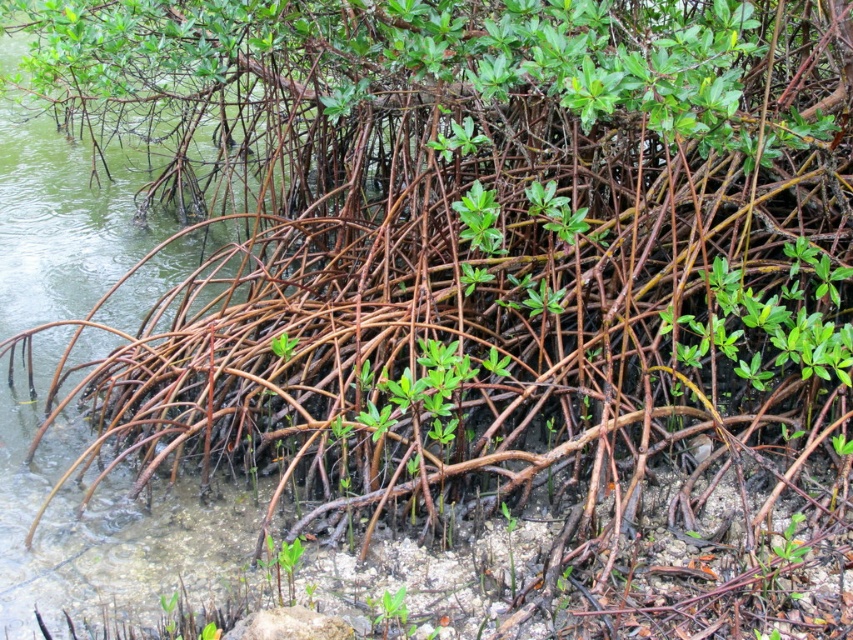
Question: Which of the following is the farthest from the observer?

Choices:
 (A) green matte leaves at center
 (B) green matte plant at center

Answer: (A)

Question: Which point appears farthest from the camera in this image?

Choices:
 (A) click(x=479, y=196)
 (B) click(x=383, y=600)

Answer: (A)

Question: Does green matte leaves at center come behind green matte plant at center?

Choices:
 (A) yes
 (B) no

Answer: (A)

Question: Does green matte leaves at center have a greater width compared to green matte plant at center?

Choices:
 (A) yes
 (B) no

Answer: (A)

Question: Is green matte leaves at center above green matte plant at center?

Choices:
 (A) no
 (B) yes

Answer: (B)

Question: Which object appears closest to the camera in this image?

Choices:
 (A) green matte leaves at center
 (B) green matte plant at center

Answer: (B)